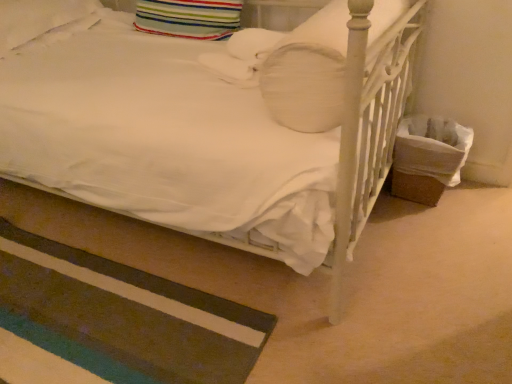
At what (x,y) coordinates should I click in order to perform the action: click on vacant space underneath striped carpet at lower left (from a real-world perspective). Please return your answer as a coordinate pair (x, y). Image resolution: width=512 pixels, height=384 pixels. Looking at the image, I should click on [87, 314].